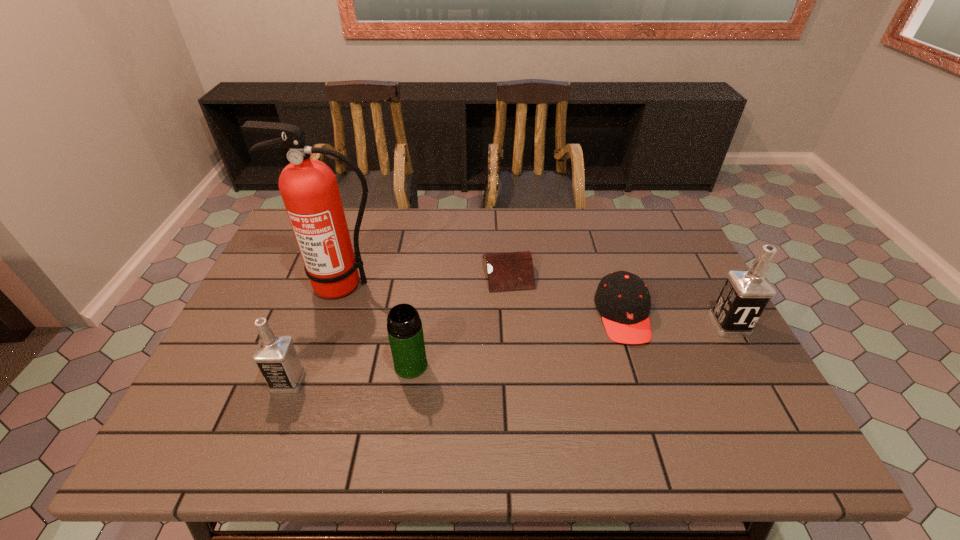
Where is `fire extinguisher located at the left edge`? The width and height of the screenshot is (960, 540). fire extinguisher located at the left edge is located at coordinates (309, 189).

The height and width of the screenshot is (540, 960). I want to click on object at the right edge, so click(746, 293).

Image resolution: width=960 pixels, height=540 pixels. Find the location of `object present at the near left corner`. object present at the near left corner is located at coordinates (275, 355).

You are a GUI agent. You are given a task and a screenshot of the screen. Output one action in this format:
    pyautogui.click(x=<x>, y=<y>)
    Task: Click on the vacant space at the far edge
    
    Given the screenshot: What is the action you would take?
    pyautogui.click(x=552, y=214)

In the image, there is a desktop. Identify the location of vacant space at the near edge. (579, 385).

In order to click on vacant space at the left edge in this screenshot , I will do `click(267, 316)`.

At what (x,y) coordinates should I click in order to perform the action: click on vacant space at the right edge of the desktop. Please return your answer as a coordinate pair (x, y). The height and width of the screenshot is (540, 960). Looking at the image, I should click on (713, 326).

In the image, there is a desktop. Where is `vacant space at the near left corner`? vacant space at the near left corner is located at coordinates (223, 404).

This screenshot has height=540, width=960. Find the location of `vacant point at the far right corner`. vacant point at the far right corner is located at coordinates click(x=664, y=221).

This screenshot has height=540, width=960. In order to click on blank region between the fourth object from right to left and the left vodka in this screenshot , I will do (349, 373).